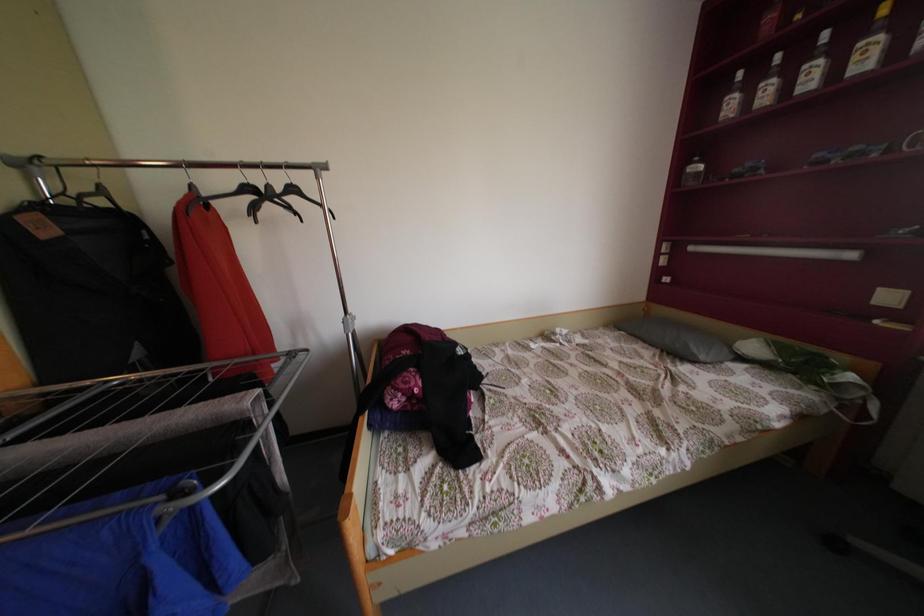
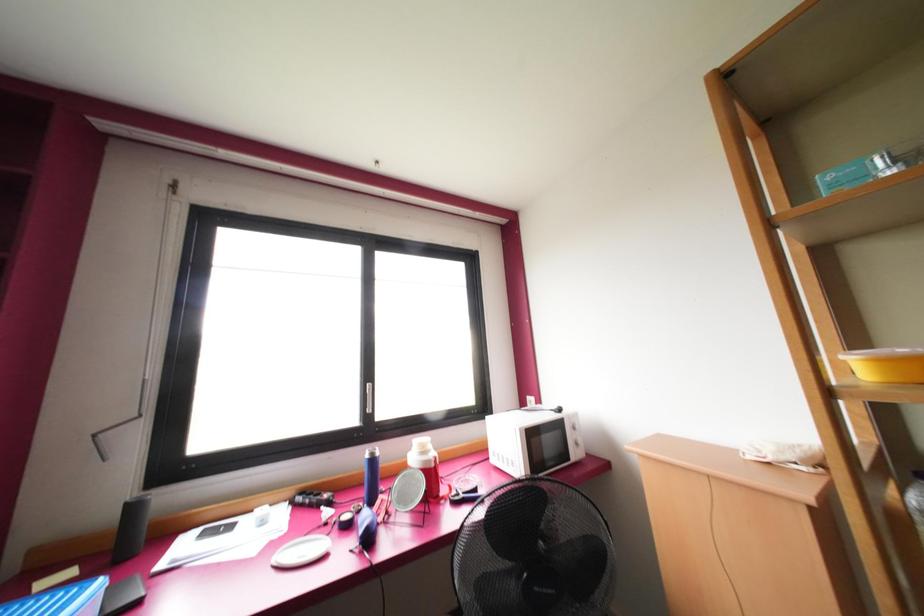
Question: The images are taken continuously from a first-person perspective. In which direction is your viewpoint rotating?

Choices:
 (A) Left
 (B) Right
 (C) Up
 (D) Down

Answer: (B)